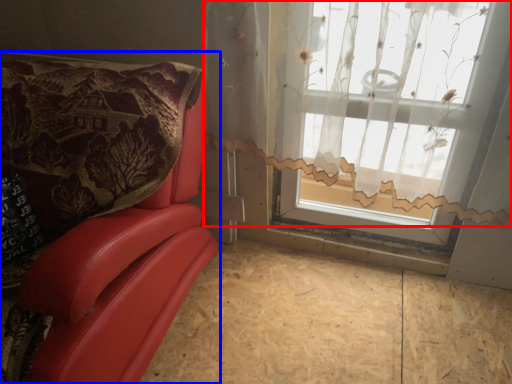
Question: Among these objects, which one is nearest to the camera, curtain (highlighted by a red box) or furniture (highlighted by a blue box)?

Choices:
 (A) curtain
 (B) furniture

Answer: (B)